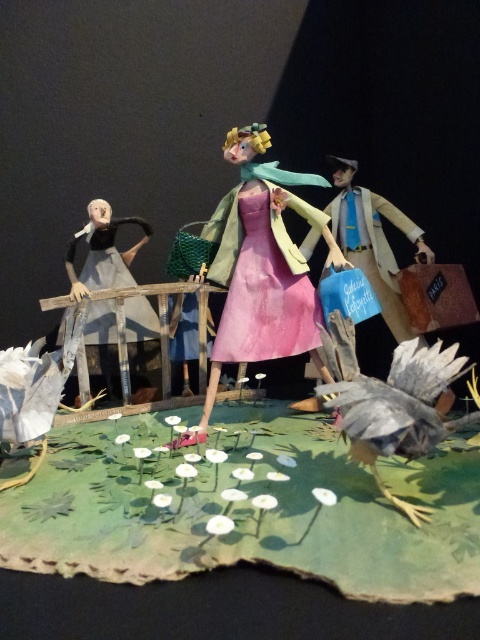
You are a bird enthusiast observing the miniature diorama. You notice the gray paper bird at lower right. Can you determine its exact position in the scene using coordinates?

The gray paper bird at lower right is located at coordinates point (391, 401).

You are a small toy car that is 5 cm tall. You want to drive under the gray paper bird at lower right and then continue to the matte gray dress at left. Can you fit under both objects without hitting your head?

The gray paper bird at lower right is shorter than the matte gray dress at left. Since the toy car is 5 cm tall, it can fit under both objects as long as the height of the gray paper bird at lower right is more than 5 cm. However, since the bird is shorter than the dress, but the exact height isn

You are looking at the miniature diorama described. There are two points marked in the scene. Which point, point (248, 209) or point (84, 269), is closer to you?

Point (248, 209) is closer to the viewer than point (84, 269).